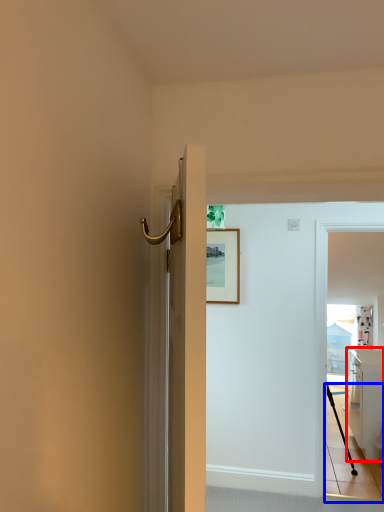
Question: Which object appears farthest to the camera in this image, cabinetry (highlighted by a red box) or path (highlighted by a blue box)?

Choices:
 (A) cabinetry
 (B) path

Answer: (A)